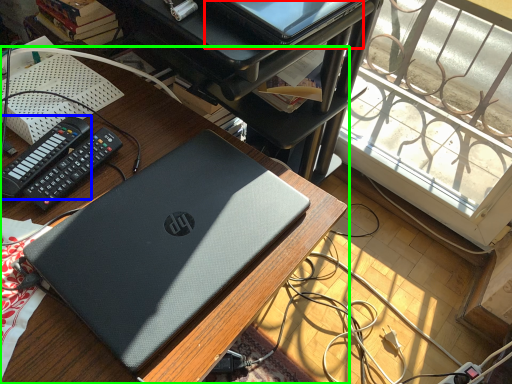
Question: Which is nearer to the computer (highlighted by a red box)? control (highlighted by a blue box) or desk (highlighted by a green box).

Choices:
 (A) control
 (B) desk

Answer: (B)